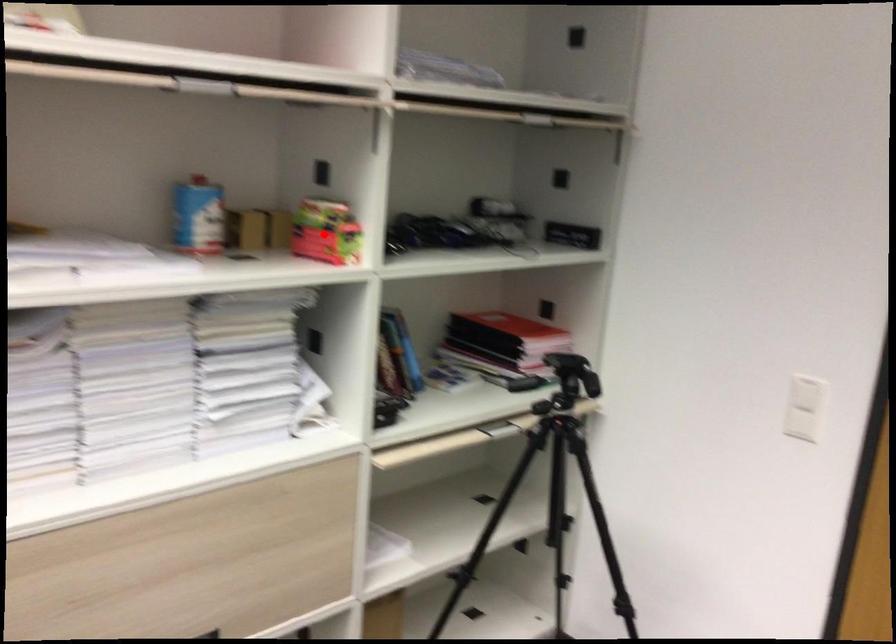
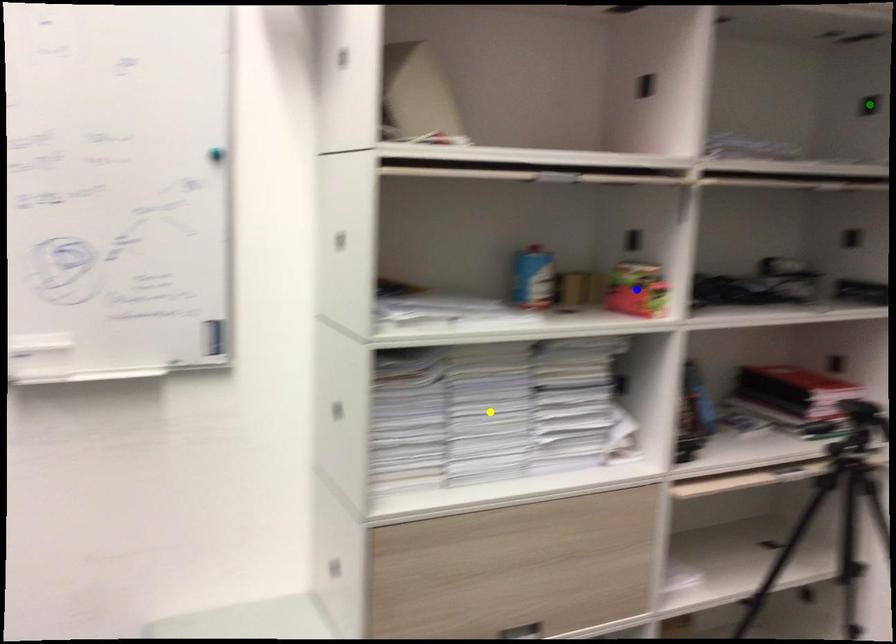
Question: I am providing you with two images of the same scene from different viewpoints. A red point is marked on the first image. You are given multiple points on the second image. Which point in image 2 is actually the same real-world point as the red point in image 1?

Choices:
 (A) green point
 (B) blue point
 (C) yellow point

Answer: (B)